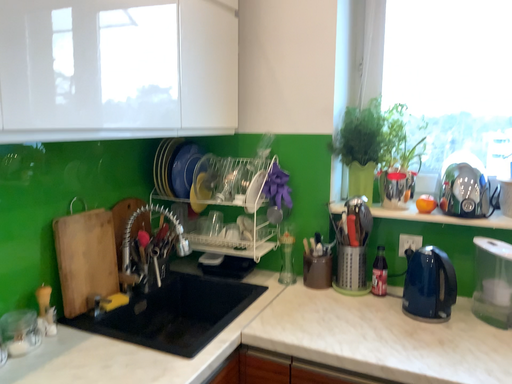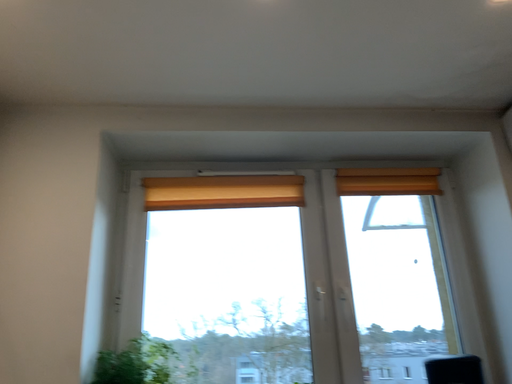
Question: How did the camera likely rotate when shooting the video?

Choices:
 (A) rotated left
 (B) rotated right

Answer: (B)